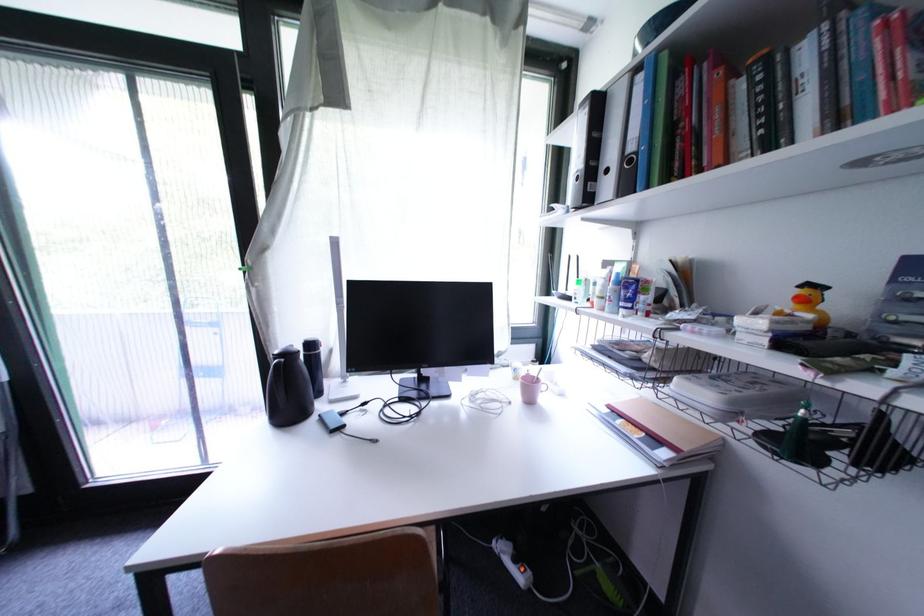
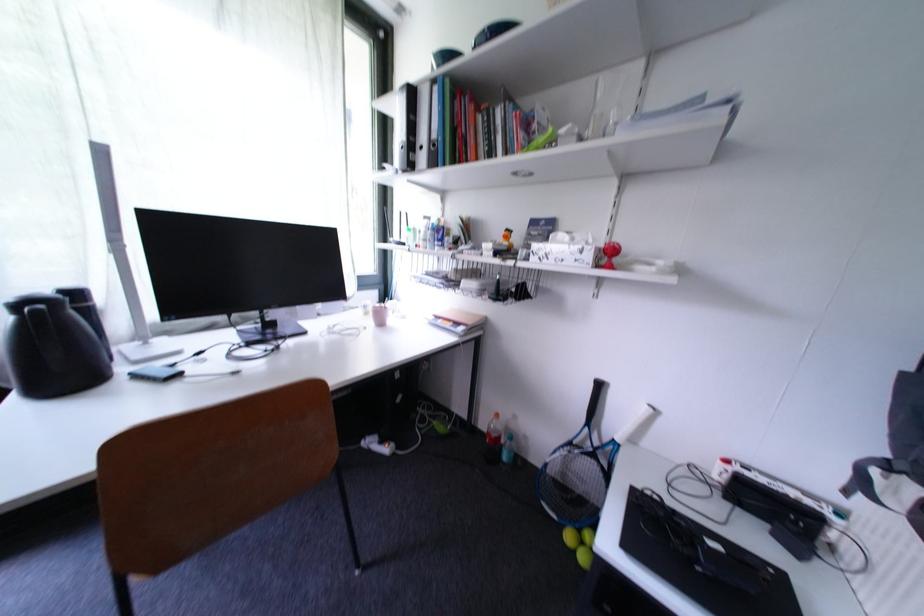
The point at (614, 174) is marked in the first image. Where is the corresponding point in the second image?

(430, 150)